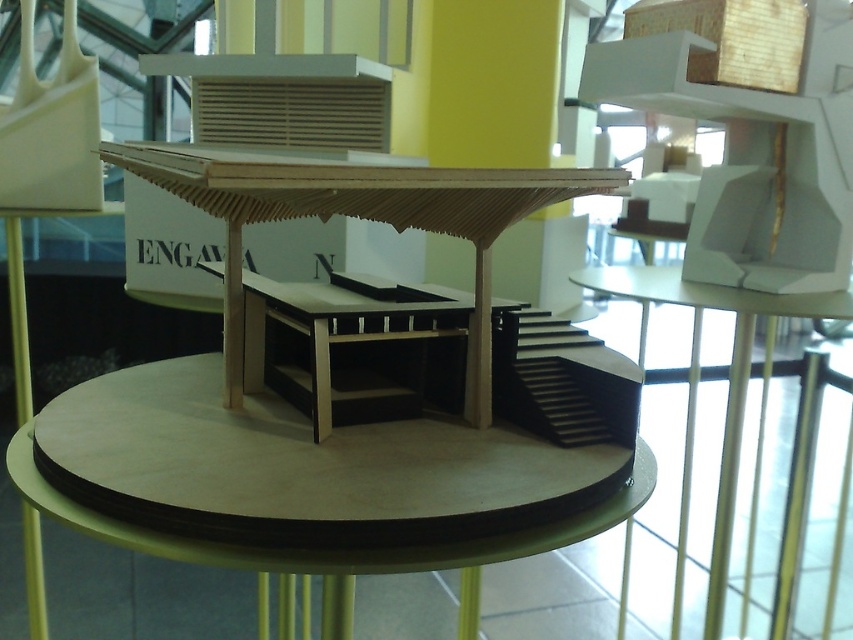
Question: Can you confirm if wooden at center is positioned below matte wood table at center?

Choices:
 (A) no
 (B) yes

Answer: (A)

Question: Can you confirm if wooden at center is positioned to the right of matte wood table at center?

Choices:
 (A) yes
 (B) no

Answer: (B)

Question: Which of the following is the closest to the observer?

Choices:
 (A) matte wood table at center
 (B) wooden at center

Answer: (B)

Question: Where is wooden at center located in relation to matte wood table at center in the image?

Choices:
 (A) right
 (B) left

Answer: (B)

Question: Which point is farther to the camera?

Choices:
 (A) wooden at center
 (B) matte wood table at center

Answer: (B)